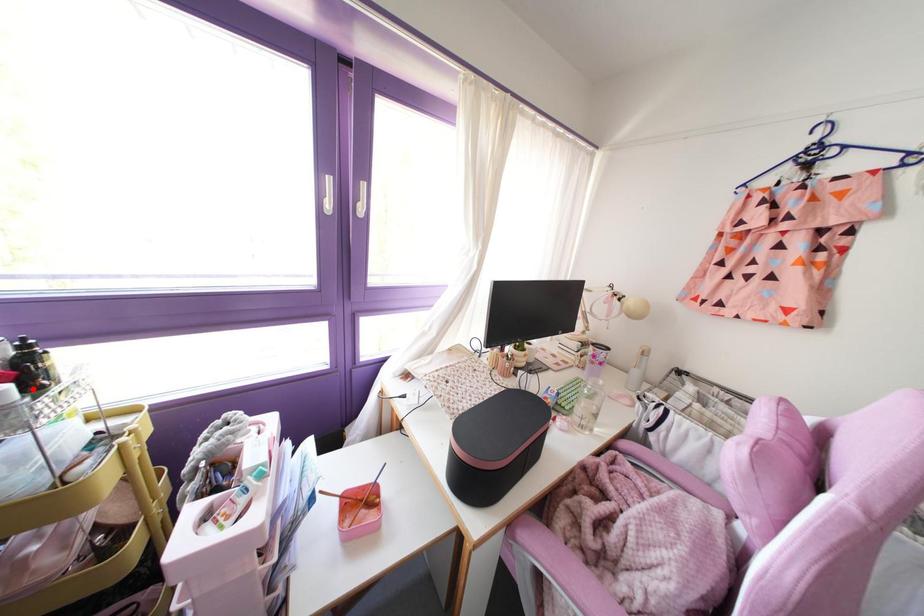
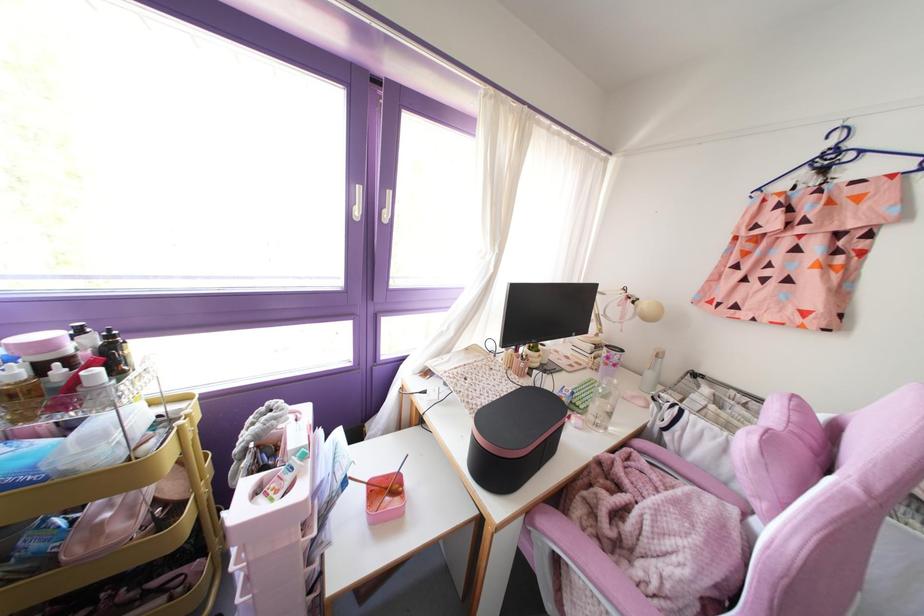
The point at the highlighted location is marked in the first image. Where is the corresponding point in the second image?

(116, 373)